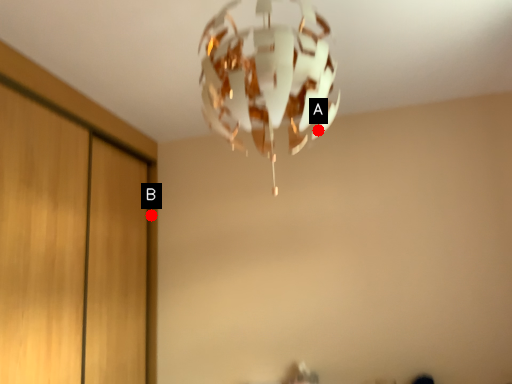
Question: Two points are circled on the image, labeled by A and B beside each circle. Which point is closer to the camera?

Choices:
 (A) A is closer
 (B) B is closer

Answer: (A)